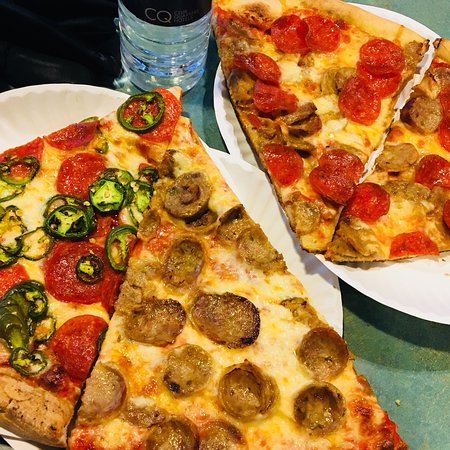
This screenshot has height=450, width=450. In order to click on table in this screenshot , I will do `click(438, 381)`.